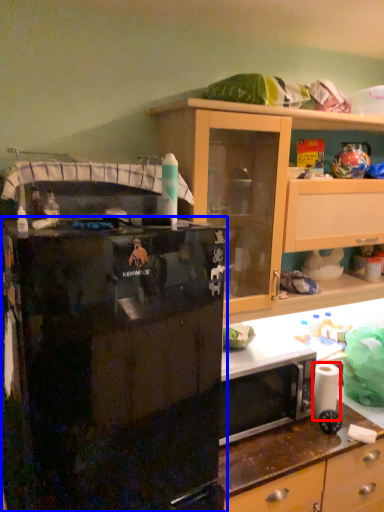
Question: Which of the following is the closest to the observer, toilet paper (highlighted by a red box) or refrigerator (highlighted by a blue box)?

Choices:
 (A) toilet paper
 (B) refrigerator

Answer: (B)